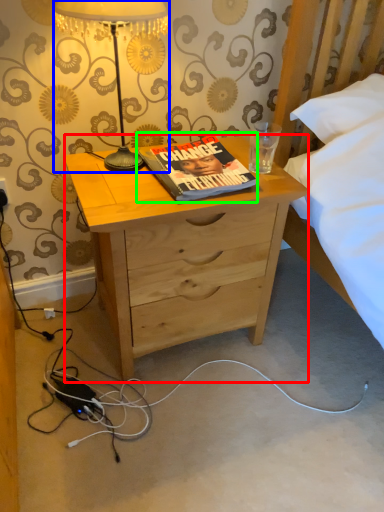
Question: Which object is positioned closest to desk (highlighted by a red box)? Select from lamp (highlighted by a blue box) and book (highlighted by a green box).

Choices:
 (A) lamp
 (B) book

Answer: (B)